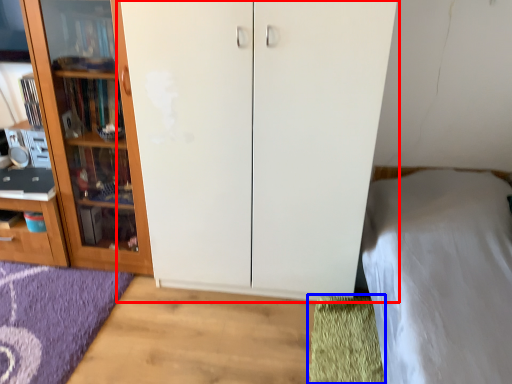
Question: Which object appears farthest to the camera in this image, cupboard (highlighted by a red box) or doormat (highlighted by a blue box)?

Choices:
 (A) cupboard
 (B) doormat

Answer: (B)